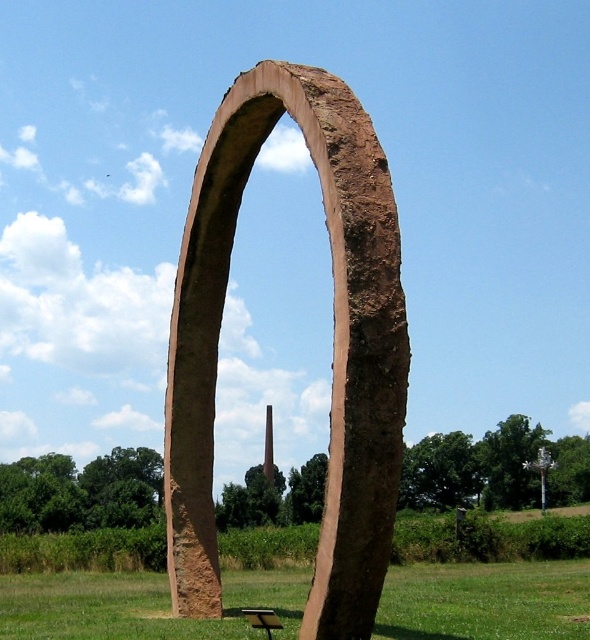
You are standing in front of the stone archway in the grassy field. You notice two points marked in the image. Which point, point (x=512, y=616) or point (x=270, y=621), is closer to you?

Point (x=512, y=616) is closer to you because it is further to the viewer than point (x=270, y=621).

You are standing in a grassy field and want to take a photo of the brown stone arch at center. To ensure the arch is centered in your camera viewfinder, where should you position yourself relative to the arch?

Since the brown stone arch at center is located at coordinates approximately 0.542 on the horizontal axis and 0.564 on the vertical axis, positioning yourself directly in front of the arch at its central point would center it in your camera viewfinder.

Based on the photo, you are planning to set up a picnic blanket for a group of 10 people. The picnic blanket requires a space of 15 square meters. Given the distance between the green grass at center and the brown wooden picnic table at lower center, can you determine if there is enough space to place the blanket without overlapping the picnic table?

The green grass at center is 17.48 meters away from the brown wooden picnic table at lower center. Since the picnic blanket requires 15 square meters, there is sufficient space between them to place the blanket without overlapping the picnic table.